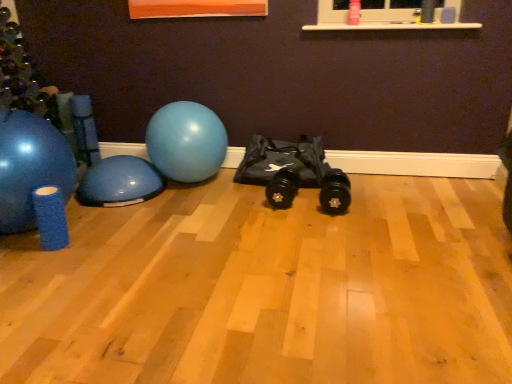
Question: From the image's perspective, is matte blue exercise ball at left, arranged as the first ball when viewed from the left, located beneath glossy rubber ball at center, the first ball when ordered from right to left?

Choices:
 (A) yes
 (B) no

Answer: (A)

Question: Is matte blue exercise ball at left, which is the third ball in right-to-left order, in front of glossy rubber ball at center, which is the 3th ball in left-to-right order?

Choices:
 (A) yes
 (B) no

Answer: (A)

Question: Considering the relative sizes of matte blue exercise ball at left, which is the third ball in right-to-left order, and glossy rubber ball at center, which is the 3th ball in left-to-right order, in the image provided, is matte blue exercise ball at left, which is the third ball in right-to-left order, wider than glossy rubber ball at center, which is the 3th ball in left-to-right order,?

Choices:
 (A) yes
 (B) no

Answer: (A)

Question: Are matte blue exercise ball at left, which is the third ball in right-to-left order, and glossy rubber ball at center, which is the 3th ball in left-to-right order, making contact?

Choices:
 (A) yes
 (B) no

Answer: (B)

Question: Could glossy rubber ball at center, which is the 3th ball in left-to-right order, be considered to be inside matte blue exercise ball at left, which is the third ball in right-to-left order?

Choices:
 (A) no
 (B) yes

Answer: (A)

Question: From the image's perspective, is matte blue exercise ball at left, arranged as the first ball when viewed from the left, over glossy rubber ball at center, the first ball when ordered from right to left?

Choices:
 (A) no
 (B) yes

Answer: (A)

Question: Can you confirm if blue rubber ball at left, the second ball when ordered from right to left, is wider than glossy rubber ball at center, the first ball when ordered from right to left?

Choices:
 (A) no
 (B) yes

Answer: (B)

Question: Is blue rubber ball at left, which ranks as the 2th ball in left-to-right order, turned away from glossy rubber ball at center, the first ball when ordered from right to left?

Choices:
 (A) yes
 (B) no

Answer: (B)

Question: Would you say glossy rubber ball at center, the first ball when ordered from right to left, is part of blue rubber ball at left, which ranks as the 2th ball in left-to-right order,'s contents?

Choices:
 (A) no
 (B) yes

Answer: (A)

Question: Does blue rubber ball at left, the second ball when ordered from right to left, touch glossy rubber ball at center, the first ball when ordered from right to left?

Choices:
 (A) no
 (B) yes

Answer: (A)

Question: Is blue rubber ball at left, which ranks as the 2th ball in left-to-right order, far from glossy rubber ball at center, the first ball when ordered from right to left?

Choices:
 (A) no
 (B) yes

Answer: (A)

Question: Is blue rubber ball at left, the second ball when ordered from right to left, located outside glossy rubber ball at center, which is the 3th ball in left-to-right order?

Choices:
 (A) no
 (B) yes

Answer: (B)

Question: Is matte blue exercise ball at left, arranged as the first ball when viewed from the left, at the right side of blue rubber ball at left, which ranks as the 2th ball in left-to-right order?

Choices:
 (A) no
 (B) yes

Answer: (A)